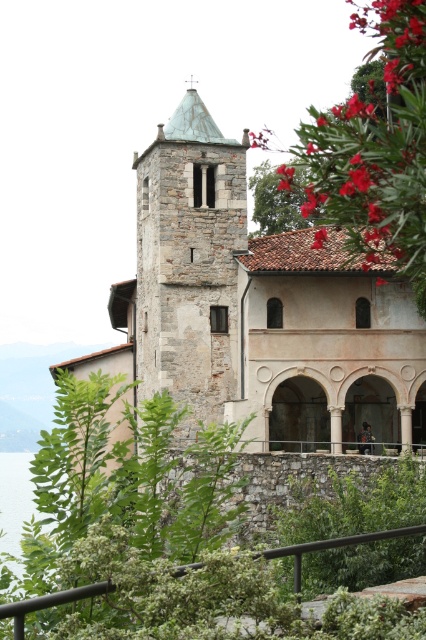
Which is above, black metal/rail at lower center or transparent water at lower left?

black metal/rail at lower center is above.

Is black metal/rail at lower center further to the viewer compared to transparent water at lower left?

That is False.

Identify the location of black metal/rail at lower center. (333, 547).

I want to click on black metal/rail at lower center, so click(x=333, y=547).

What are the coordinates of `stone church at center` in the screenshot? It's located at (256, 308).

Locate an element on the screen. This screenshot has width=426, height=640. stone church at center is located at coordinates (256, 308).

What do you see at coordinates (129, 477) in the screenshot? I see `green leafy plant at center` at bounding box center [129, 477].

Which of these two, green leafy plant at center or black metal/rail at lower center, stands taller?

Standing taller between the two is green leafy plant at center.

Which is in front, point (195, 460) or point (353, 540)?

Point (353, 540) is in front.

Image resolution: width=426 pixels, height=640 pixels. Find the location of `green leafy plant at center`. green leafy plant at center is located at coordinates (129, 477).